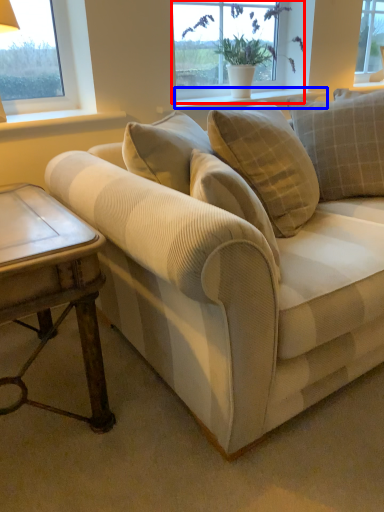
Question: Which point is further to the camera, window (highlighted by a red box) or window sill (highlighted by a blue box)?

Choices:
 (A) window
 (B) window sill

Answer: (A)